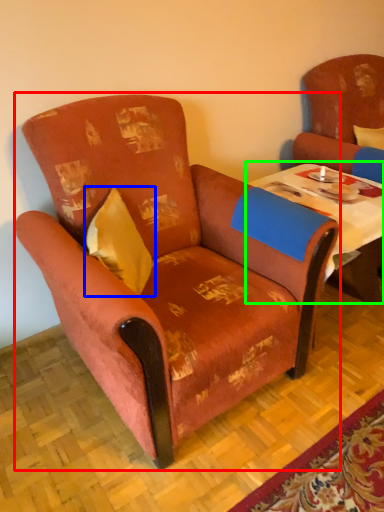
Question: Considering the real-world distances, which object is farthest from chair (highlighted by a red box)? pillow (highlighted by a blue box) or table (highlighted by a green box)?

Choices:
 (A) pillow
 (B) table

Answer: (B)